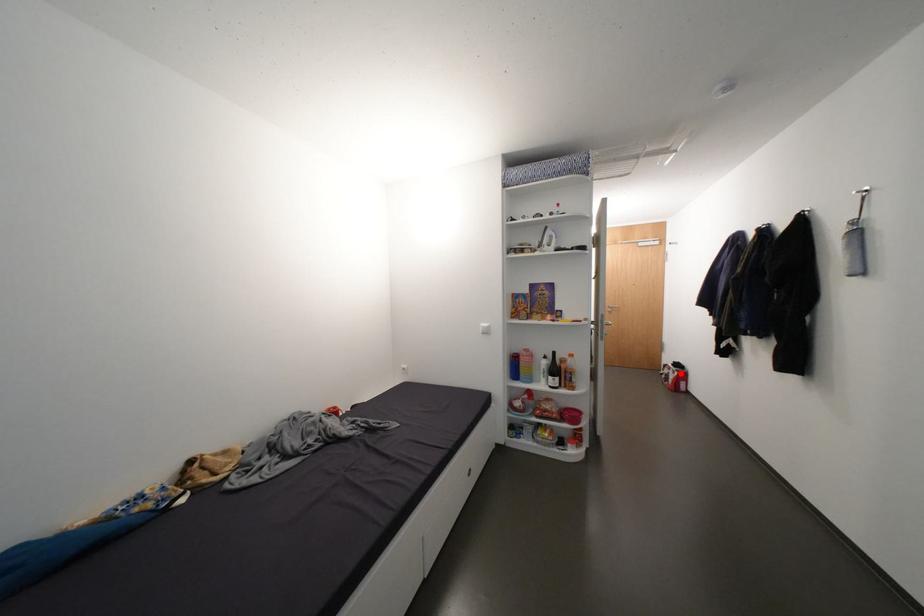
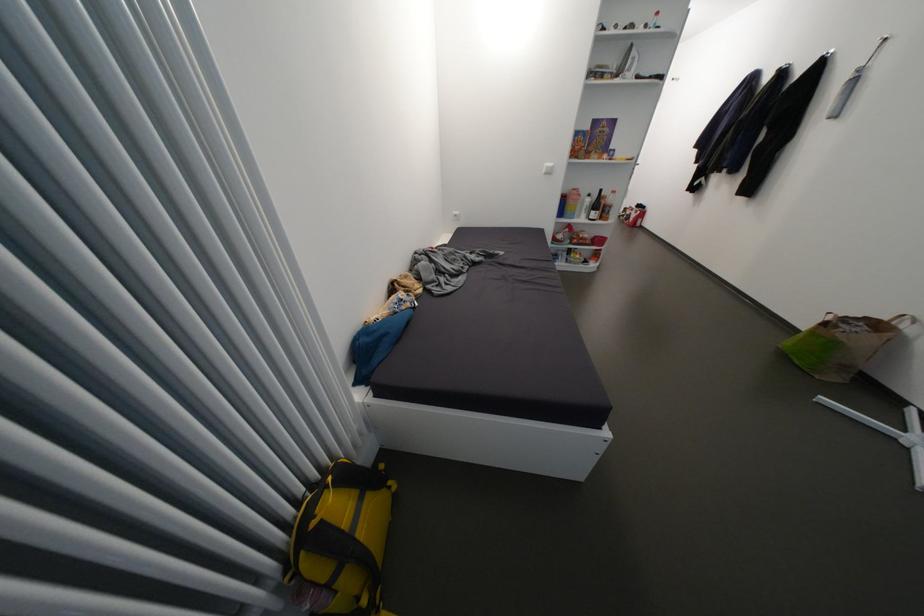
Locate, in the second image, the point that corresponds to the highlighted location in the first image.

(642, 214)